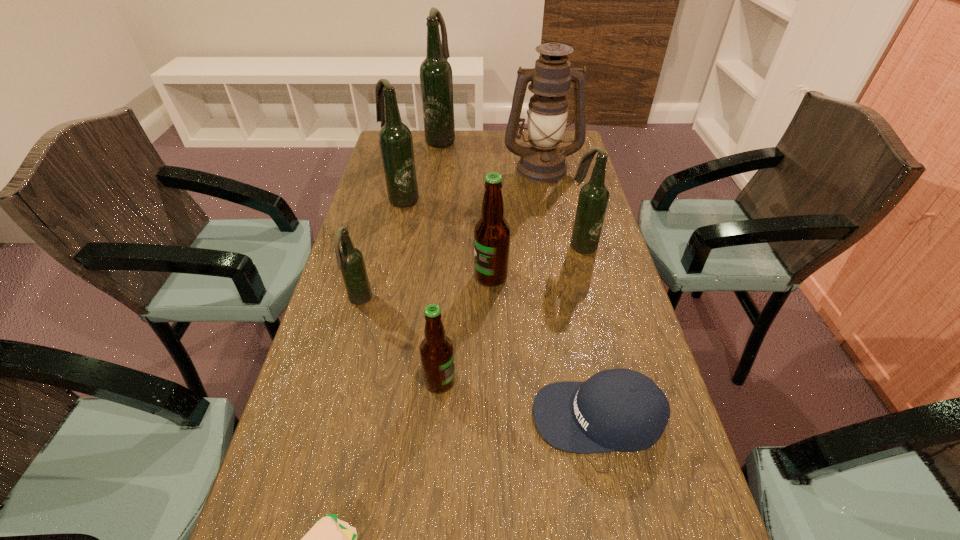
This screenshot has width=960, height=540. I want to click on the tallest beer bottle, so click(436, 79).

The height and width of the screenshot is (540, 960). Find the location of `the farthest dark beer bottle`. the farthest dark beer bottle is located at coordinates (436, 79).

Identify the location of the eighth nearest object. (543, 161).

The width and height of the screenshot is (960, 540). In order to click on oil lamp in this screenshot , I will do `click(543, 161)`.

Locate an element on the screen. the fifth shortest beer bottle is located at coordinates (395, 138).

The height and width of the screenshot is (540, 960). What are the coordinates of `the second farthest dark beer bottle` in the screenshot? It's located at (395, 138).

The width and height of the screenshot is (960, 540). Identify the location of the fourth object from right to left. (492, 232).

Identify the location of the bigger brown beer bottle. (492, 232).

Where is `the second nearest dark beer bottle`? the second nearest dark beer bottle is located at coordinates (593, 199).

Locate an element on the screen. The height and width of the screenshot is (540, 960). the fourth farthest object is located at coordinates coord(593,199).